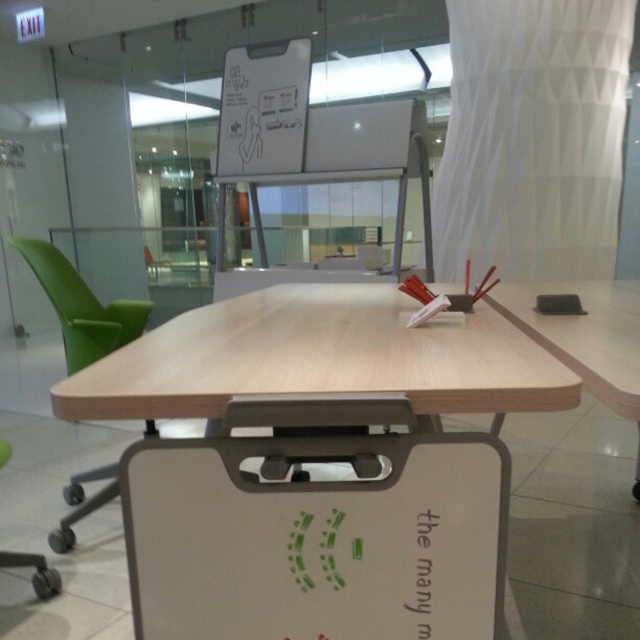
Question: Can you confirm if light wood table at center is smaller than white matte dry erase board at upper center?

Choices:
 (A) no
 (B) yes

Answer: (A)

Question: Which is farther from the green fabric chair at left?

Choices:
 (A) green plastic chair at left
 (B) light wood table at center

Answer: (B)

Question: Based on their relative distances, which object is farther from the light wood table at center?

Choices:
 (A) green plastic chair at left
 (B) white matte dry erase board at upper center

Answer: (B)

Question: Which point appears closest to the camera in this image?

Choices:
 (A) (152, 260)
 (B) (244, 70)
 (C) (122, 308)
 (D) (422, 340)

Answer: (D)

Question: Does white matte dry erase board at upper center come in front of green fabric chair at left?

Choices:
 (A) yes
 (B) no

Answer: (A)

Question: Is white matte dry erase board at upper center wider than green plastic chair at left?

Choices:
 (A) yes
 (B) no

Answer: (A)